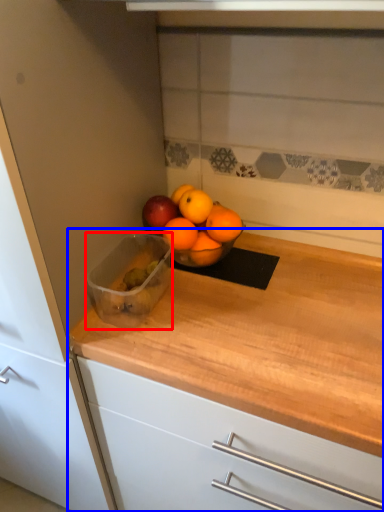
Question: Which object appears farthest to the camera in this image, glass bowl (highlighted by a red box) or countertop (highlighted by a blue box)?

Choices:
 (A) glass bowl
 (B) countertop

Answer: (A)